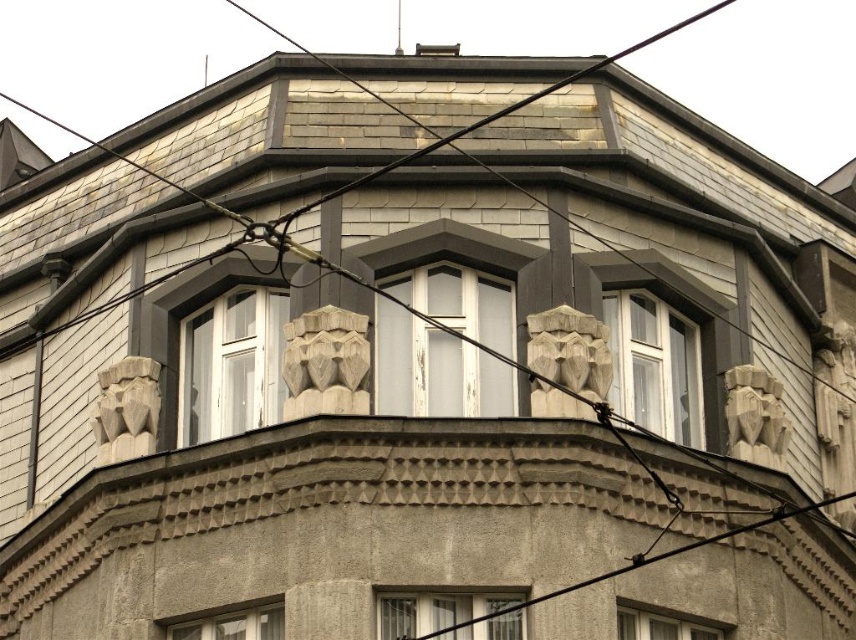
Question: Is clear glass window at center below matte gray window at lower left?

Choices:
 (A) no
 (B) yes

Answer: (A)

Question: Does carved stone lion head at center appear on the left side of gray stone sculpture at upper right?

Choices:
 (A) no
 (B) yes

Answer: (B)

Question: Which point is farther to the camera?

Choices:
 (A) matte gray window at lower left
 (B) carved stone lion head at center
 (C) white glass window at upper center
 (D) gray stone sculpture at upper right

Answer: (C)

Question: Among these objects, which one is farthest from the camera?

Choices:
 (A) gray stone sculpture at center
 (B) matte gray window at lower center
 (C) gray stone lion head at left
 (D) transparent glass window at center

Answer: (C)

Question: Which point is closer to the camera?

Choices:
 (A) gray stone sculpture at center
 (B) gray stone sculpture at upper right
 (C) matte gray window at lower left
 (D) white glass window at center

Answer: (C)

Question: From the image, what is the correct spatial relationship of gray stone sculpture at upper right in relation to matte gray window at lower left?

Choices:
 (A) below
 (B) above

Answer: (B)